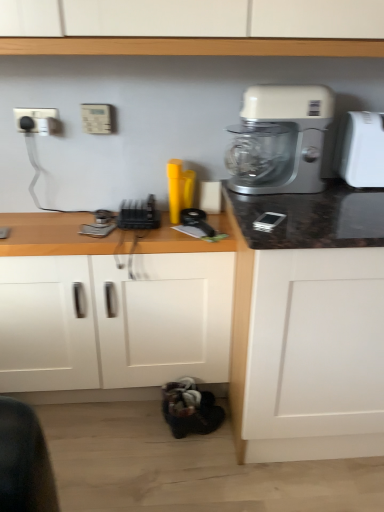
Question: Is white plastic electric outlet at upper left, positioned as the 2th electric outlet in right-to-left order, at the back of beige plastic electric outlet at upper center, the first electric outlet when ordered from right to left?

Choices:
 (A) no
 (B) yes

Answer: (A)

Question: Considering the relative sizes of beige plastic electric outlet at upper center, which is counted as the second electric outlet, starting from the left, and white plastic electric outlet at upper left, the 1th electric outlet when ordered from left to right, in the image provided, is beige plastic electric outlet at upper center, which is counted as the second electric outlet, starting from the left, wider than white plastic electric outlet at upper left, the 1th electric outlet when ordered from left to right,?

Choices:
 (A) no
 (B) yes

Answer: (B)

Question: Would you say beige plastic electric outlet at upper center, which is counted as the second electric outlet, starting from the left, is a long distance from white plastic electric outlet at upper left, positioned as the 2th electric outlet in right-to-left order?

Choices:
 (A) no
 (B) yes

Answer: (A)

Question: Can you confirm if beige plastic electric outlet at upper center, the first electric outlet when ordered from right to left, is shorter than white plastic electric outlet at upper left, the 1th electric outlet when ordered from left to right?

Choices:
 (A) yes
 (B) no

Answer: (B)

Question: Can you confirm if beige plastic electric outlet at upper center, which is counted as the second electric outlet, starting from the left, is positioned to the right of white plastic electric outlet at upper left, the 1th electric outlet when ordered from left to right?

Choices:
 (A) yes
 (B) no

Answer: (A)

Question: Is white plastic electric outlet at upper left, the 1th electric outlet when ordered from left to right, bigger or smaller than beige plastic electric outlet at upper center, the first electric outlet when ordered from right to left?

Choices:
 (A) small
 (B) big

Answer: (A)

Question: From a real-world perspective, is white plastic electric outlet at upper left, positioned as the 2th electric outlet in right-to-left order, above or below beige plastic electric outlet at upper center, the first electric outlet when ordered from right to left?

Choices:
 (A) above
 (B) below

Answer: (B)

Question: Relative to beige plastic electric outlet at upper center, which is counted as the second electric outlet, starting from the left, is white plastic electric outlet at upper left, the 1th electric outlet when ordered from left to right, in front or behind?

Choices:
 (A) behind
 (B) front

Answer: (A)

Question: Is white plastic electric outlet at upper left, positioned as the 2th electric outlet in right-to-left order, to the left or to the right of beige plastic electric outlet at upper center, the first electric outlet when ordered from right to left, in the image?

Choices:
 (A) left
 (B) right

Answer: (A)

Question: Would you say white plastic mixer at upper right is inside or outside black plastic toaster at center?

Choices:
 (A) inside
 (B) outside

Answer: (B)

Question: Considering their positions, is white plastic mixer at upper right located in front of or behind black plastic toaster at center?

Choices:
 (A) front
 (B) behind

Answer: (A)

Question: Considering the positions of point (263, 114) and point (130, 227), is point (263, 114) closer or farther from the camera than point (130, 227)?

Choices:
 (A) farther
 (B) closer

Answer: (B)

Question: Is white plastic mixer at upper right wider or thinner than black plastic toaster at center?

Choices:
 (A) wide
 (B) thin

Answer: (B)

Question: Relative to wooden at lower left, is white plastic electric outlet at upper left, positioned as the 2th electric outlet in right-to-left order, in front or behind?

Choices:
 (A) front
 (B) behind

Answer: (B)

Question: From a real-world perspective, relative to wooden at lower left, is white plastic electric outlet at upper left, positioned as the 2th electric outlet in right-to-left order, vertically above or below?

Choices:
 (A) below
 (B) above

Answer: (B)